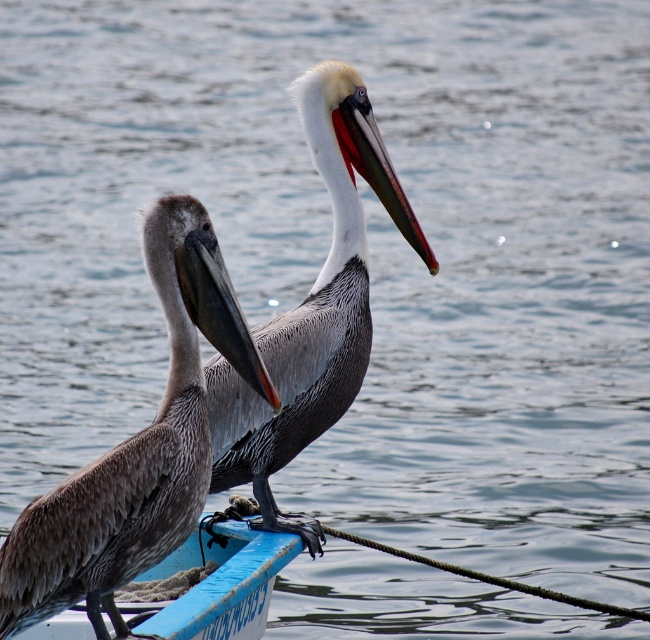
Question: Which object is closer to the camera taking this photo?

Choices:
 (A) brown speckled pelican at center
 (B) blue plastic boat at center

Answer: (B)

Question: Among these objects, which one is farthest from the camera?

Choices:
 (A) blue plastic boat at center
 (B) brown feathered pelican at center

Answer: (A)

Question: Does brown feathered pelican at center appear on the left side of blue plastic boat at center?

Choices:
 (A) no
 (B) yes

Answer: (B)

Question: Based on their relative distances, which object is farther from the brown speckled pelican at center?

Choices:
 (A) blue plastic boat at center
 (B) brown feathered pelican at center

Answer: (B)

Question: Does brown feathered pelican at center lie in front of blue plastic boat at center?

Choices:
 (A) no
 (B) yes

Answer: (B)

Question: Is brown speckled pelican at center to the left of blue plastic boat at center from the viewer's perspective?

Choices:
 (A) no
 (B) yes

Answer: (A)